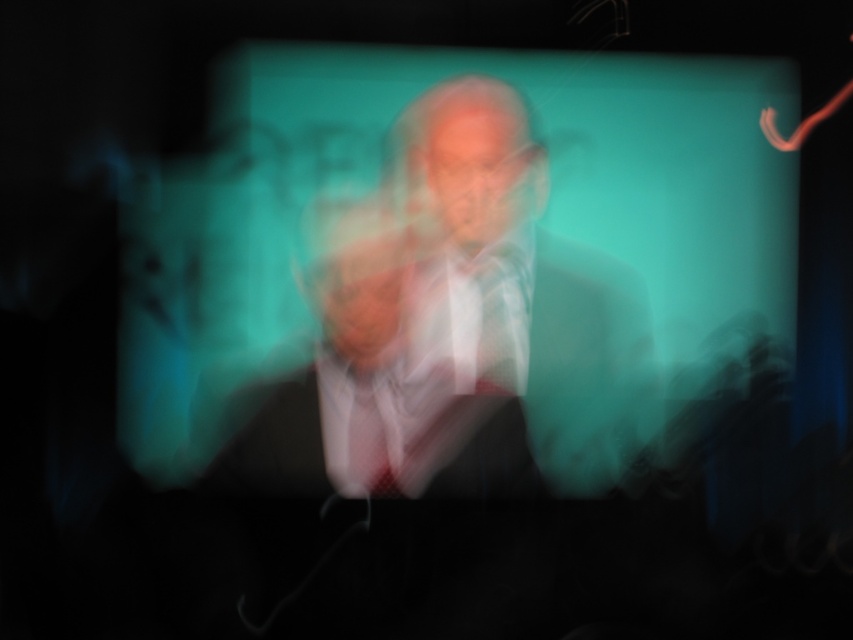
You are a photographer who wants to ensure that the subject in the image is properly framed. Given the smooth black suit at center and the checkered fabric tie at center, which object is wider in the image?

The smooth black suit at center is wider than the checkered fabric tie at center.

You are a fashion designer analyzing the blurred image of a person in formal attire. You need to determine if the matte black suit at center can accommodate a standard collar for the checkered fabric tie at center. Based on their sizes, is this possible?

The matte black suit at center is taller than the checkered fabric tie at center, so it should have enough space to accommodate a standard collar for the checkered fabric tie at center.

You are a photographer analyzing this blurred image of a person. You notice the smooth black suit at center and the checkered fabric tie at center. Based on the image, which object is positioned more to the left?

The checkered fabric tie at center is positioned more to the left since the smooth black suit at center is to the right of it.